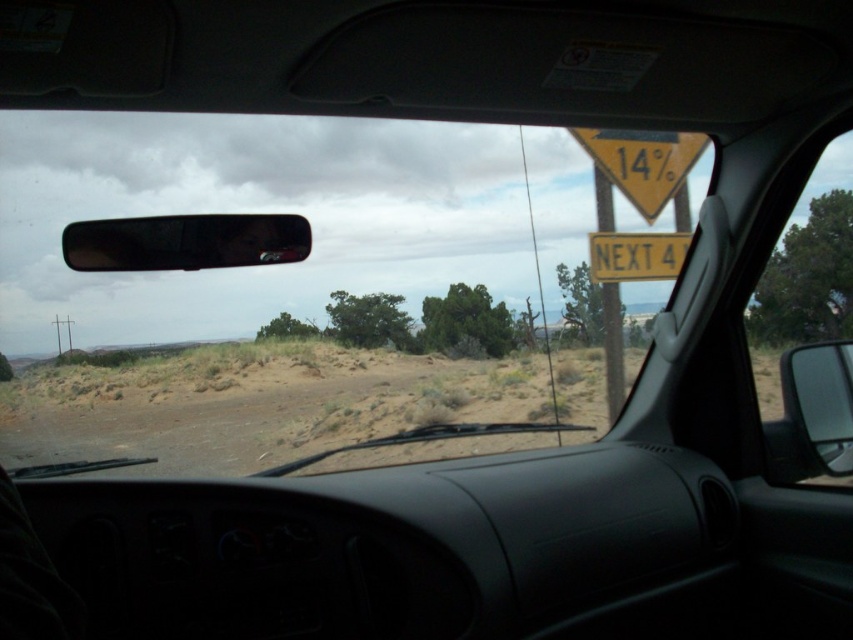
Question: Which is farther from the transparent glass car window at right?

Choices:
 (A) yellow/yellowish metal signpost at right
 (B) transparent glass car window at upper center

Answer: (B)

Question: Does brown sandy dirt field at center appear on the left side of yellow/yellowish metal signpost at right?

Choices:
 (A) no
 (B) yes

Answer: (B)

Question: Which of the following is the farthest from the observer?

Choices:
 (A) yellow/yellowish metal sign at upper right
 (B) brown sandy dirt field at center
 (C) transparent glass car window at upper center

Answer: (B)

Question: Which object is the farthest from the brown sandy dirt field at center?

Choices:
 (A) transparent glass car window at right
 (B) yellow/yellowish metal signpost at right
 (C) transparent glass car window at upper center
 (D) yellow/yellowish metal sign at upper right

Answer: (A)

Question: In this image, where is transparent glass car window at right located relative to yellow/yellowish metal sign at upper right?

Choices:
 (A) right
 (B) left

Answer: (A)

Question: Does brown sandy dirt field at center appear on the right side of yellow/yellowish metal signpost at right?

Choices:
 (A) no
 (B) yes

Answer: (A)